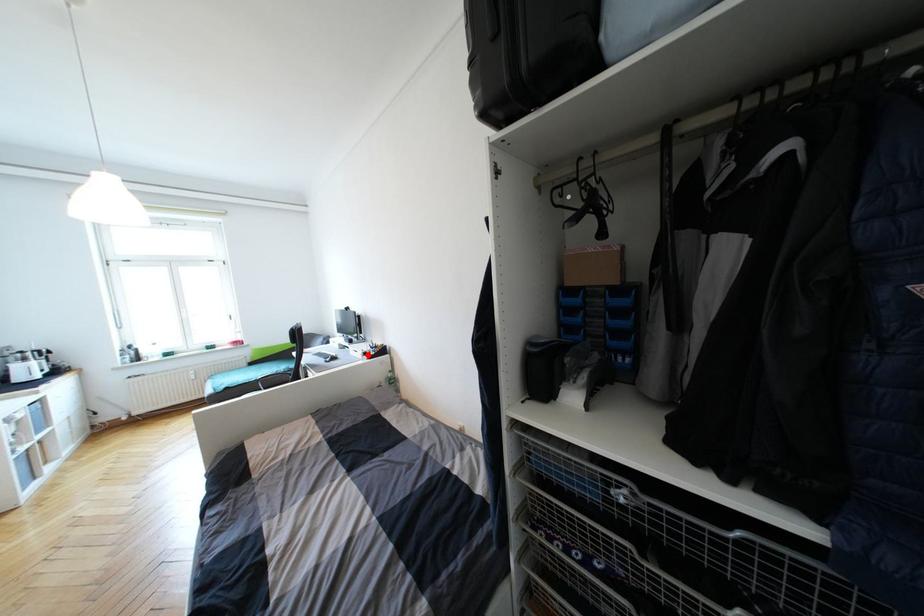
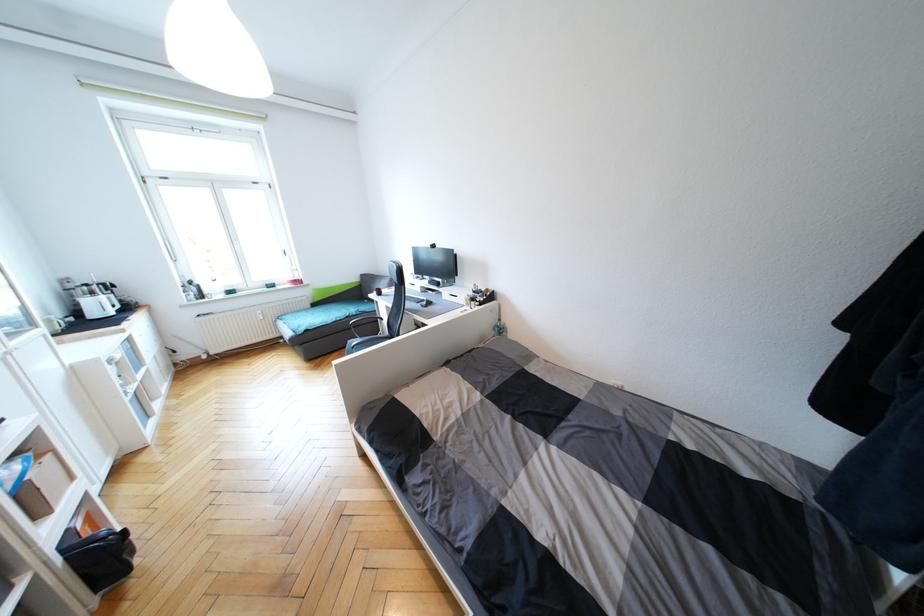
In the second image, find the point that corresponds to the highlighted location in the first image.

(476, 301)